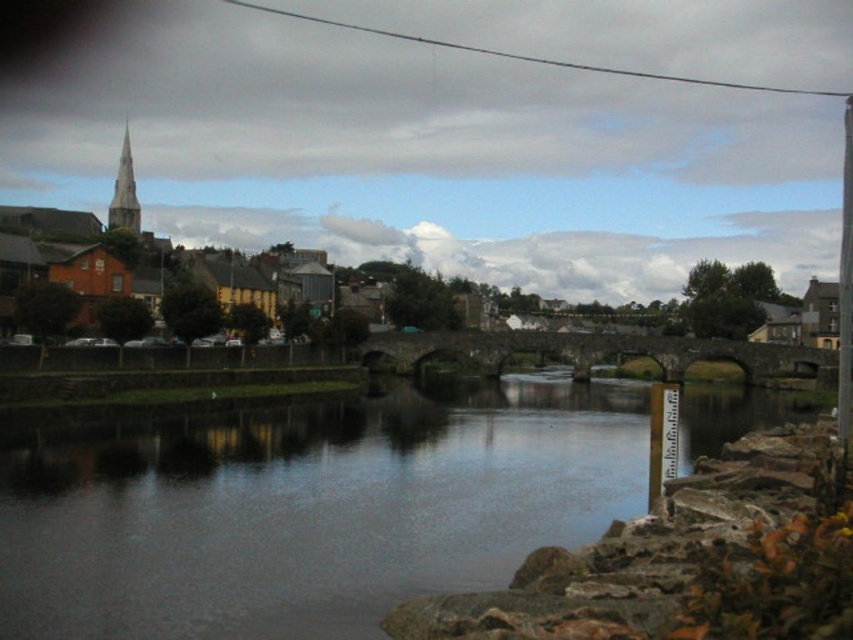
You are a tourist standing on the stone bridge and want to take a photo of the brown wooden houses at upper left and the smooth gray spire at upper left. Which object will appear closer to you in the photo?

The brown wooden houses at upper left will appear closer to you in the photo because they are positioned further to the viewer than the smooth gray spire at upper left.

You are a tourist standing on the stone bridge and want to take a photo of the brown wooden houses at upper left and the smooth concrete river at center. Which object should you point your camera towards first if you want to capture both in one shot?

You should point your camera towards the brown wooden houses at upper left first because the smooth concrete river at center is to the right of them, so by framing the houses on the left side of the photo, you can include the river extending to the right in the same shot.

You are a bird flying over the riverside scene. You want to land on the tallest structure between the brown wooden houses at upper left and the smooth gray spire at upper left. Which one should you choose?

The brown wooden houses at upper left are taller than the smooth gray spire at upper left, so you should choose the brown wooden houses at upper left to land on.